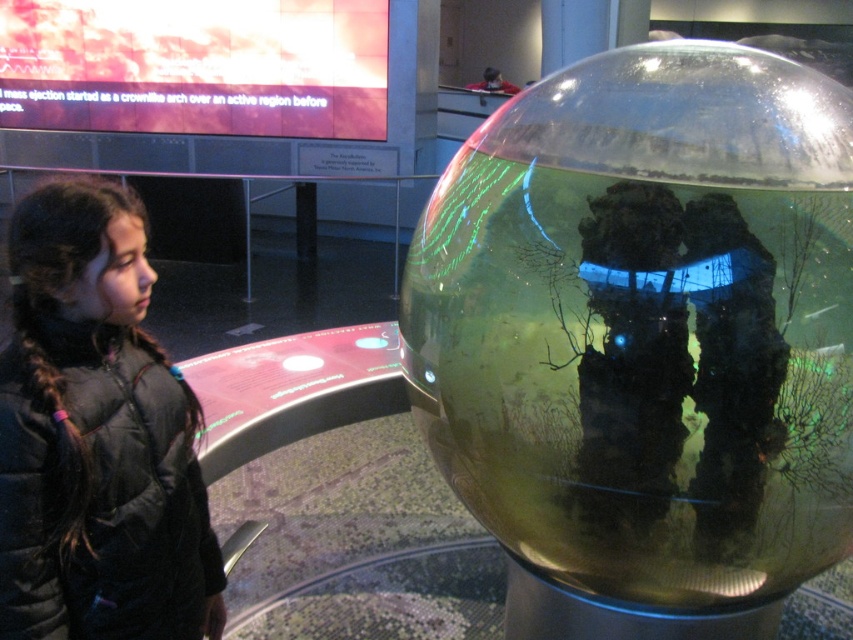
Which of these two, transparent glass sphere at center or black puffy jacket at left, stands taller?

transparent glass sphere at center

Is point (553, 310) more distant than point (7, 464)?

No, (553, 310) is in front of (7, 464).

At what (x,y) coordinates should I click in order to perform the action: click on transparent glass sphere at center. Please return your answer as a coordinate pair (x, y). Image resolution: width=853 pixels, height=640 pixels. Looking at the image, I should click on (646, 323).

Find the location of a particular element. The height and width of the screenshot is (640, 853). transparent glass sphere at center is located at coordinates (646, 323).